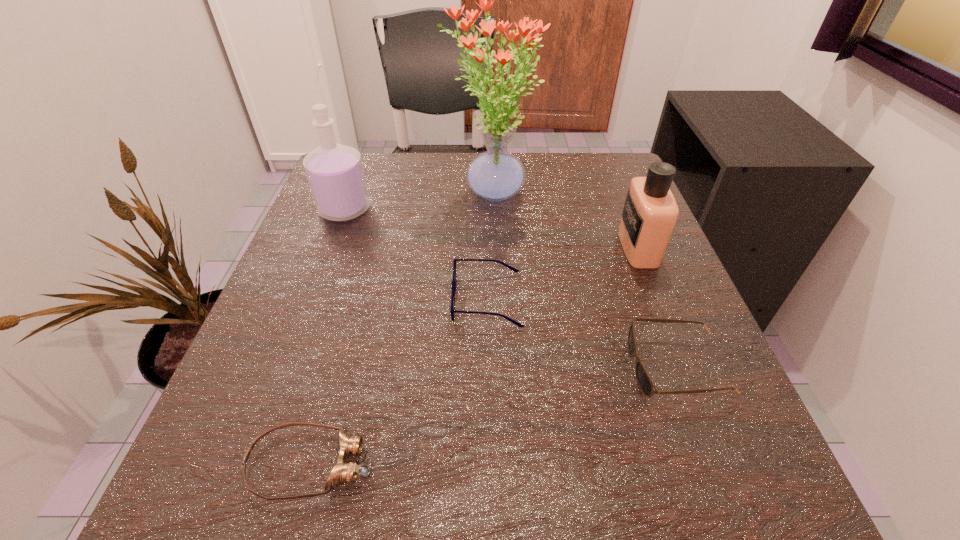
The width and height of the screenshot is (960, 540). I want to click on free region at the far edge of the desktop, so click(x=448, y=178).

Where is `vacant space at the left edge`? Image resolution: width=960 pixels, height=540 pixels. vacant space at the left edge is located at coordinates (324, 332).

The image size is (960, 540). Find the location of `blank space at the right edge of the desktop`. blank space at the right edge of the desktop is located at coordinates 632,372.

Where is `vacant space at the near left corner of the desktop`? Image resolution: width=960 pixels, height=540 pixels. vacant space at the near left corner of the desktop is located at coordinates (290, 492).

This screenshot has width=960, height=540. Find the location of `vacant space at the near right corner of the desktop`. vacant space at the near right corner of the desktop is located at coordinates (708, 516).

This screenshot has width=960, height=540. In order to click on free space between the flower arrangement and the spectacles in this screenshot , I will do `click(489, 246)`.

Find the location of `free space between the third tallest object and the fifth farthest object`. free space between the third tallest object and the fifth farthest object is located at coordinates (657, 307).

Locate an element on the screen. The image size is (960, 540). blank region between the tallest object and the third tallest object is located at coordinates (564, 220).

This screenshot has height=540, width=960. Find the location of `vacant area between the taller perfume and the spectacles`. vacant area between the taller perfume and the spectacles is located at coordinates (x=416, y=255).

Locate an element on the screen. unoccupied position between the flower arrangement and the goggles is located at coordinates (401, 328).